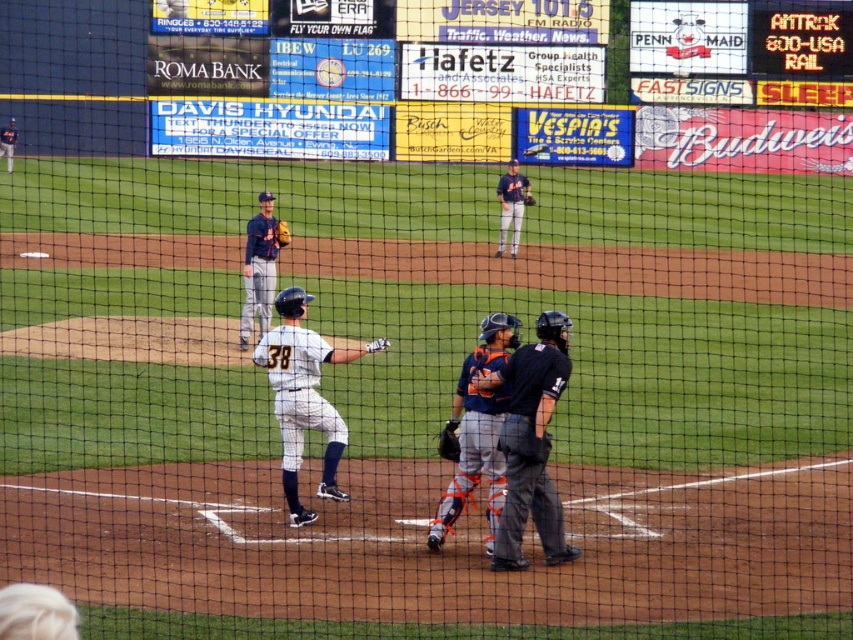
Does matte gray uniform at center appear on the right side of dark blue uniform at upper center?

In fact, matte gray uniform at center is to the left of dark blue uniform at upper center.

Is matte gray uniform at center shorter than dark blue uniform at upper center?

Correct, matte gray uniform at center is not as tall as dark blue uniform at upper center.

Is point (252, 312) behind point (517, 182)?

No, (252, 312) is closer to viewer.

Where is `matte gray uniform at center`? The image size is (853, 640). matte gray uniform at center is located at coordinates (259, 268).

Is white uniform at home plate above matte black bat at center?

No, white uniform at home plate is not above matte black bat at center.

Measure the distance between white uniform at home plate and matte black bat at center.

white uniform at home plate is 39.53 meters from matte black bat at center.

Is point (281, 305) closer to camera compared to point (541, 147)?

Yes.

Identify the location of white uniform at home plate. (302, 396).

Can you confirm if black matte umpire at center is positioned above yellow leather glove at center?

Actually, black matte umpire at center is below yellow leather glove at center.

Between black matte umpire at center and yellow leather glove at center, which one is positioned lower?

Positioned lower is black matte umpire at center.

The width and height of the screenshot is (853, 640). What are the coordinates of `black matte umpire at center` in the screenshot? It's located at (531, 444).